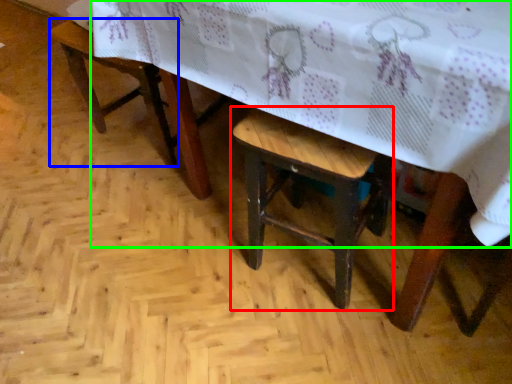
Question: Which object is positioned closest to stool (highlighted by a red box)? Select from armchair (highlighted by a blue box) and table (highlighted by a green box).

Choices:
 (A) armchair
 (B) table

Answer: (B)